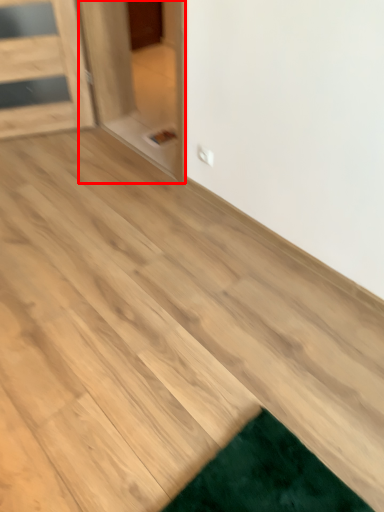
Question: Observing the image, what is the correct spatial positioning of glass door (annotated by the red box) in reference to plywood?

Choices:
 (A) right
 (B) left

Answer: (A)